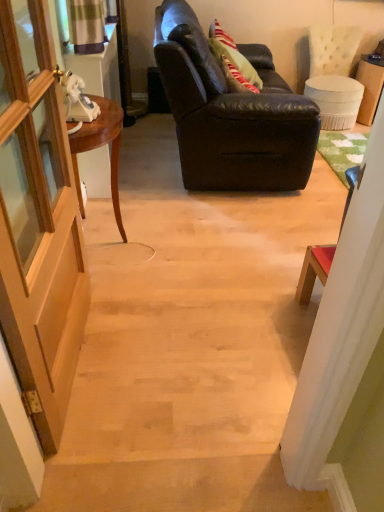
Question: Does green textured curtain at upper left appear on the right side of wooden door at left?

Choices:
 (A) yes
 (B) no

Answer: (B)

Question: Is wooden door at left completely or partially inside green textured curtain at upper left?

Choices:
 (A) yes
 (B) no

Answer: (B)

Question: Is green textured curtain at upper left far from wooden door at left?

Choices:
 (A) no
 (B) yes

Answer: (B)

Question: Can you confirm if green textured curtain at upper left is shorter than wooden door at left?

Choices:
 (A) no
 (B) yes

Answer: (B)

Question: Is green textured curtain at upper left further to camera compared to wooden door at left?

Choices:
 (A) yes
 (B) no

Answer: (A)

Question: Is green textured curtain at upper left oriented towards wooden door at left?

Choices:
 (A) yes
 (B) no

Answer: (B)

Question: From a real-world perspective, is wooden door at left beneath leather couch at upper center?

Choices:
 (A) no
 (B) yes

Answer: (A)

Question: From a real-world perspective, is wooden door at left over leather couch at upper center?

Choices:
 (A) no
 (B) yes

Answer: (B)

Question: Considering the relative sizes of wooden door at left and leather couch at upper center in the image provided, is wooden door at left taller than leather couch at upper center?

Choices:
 (A) no
 (B) yes

Answer: (B)

Question: Are wooden door at left and leather couch at upper center beside each other?

Choices:
 (A) yes
 (B) no

Answer: (B)

Question: Is wooden door at left to the right of leather couch at upper center from the viewer's perspective?

Choices:
 (A) no
 (B) yes

Answer: (A)

Question: Can you confirm if wooden door at left is thinner than leather couch at upper center?

Choices:
 (A) yes
 (B) no

Answer: (A)

Question: Is mahogany wood desk at left thinner than green textured curtain at upper left?

Choices:
 (A) yes
 (B) no

Answer: (B)